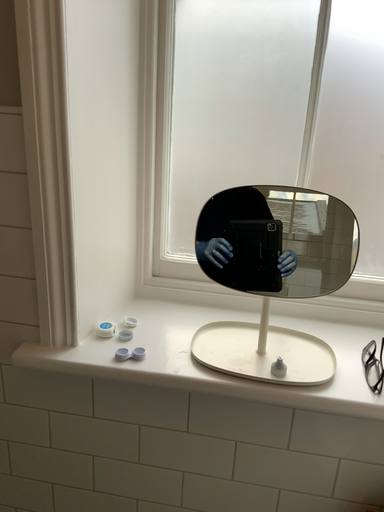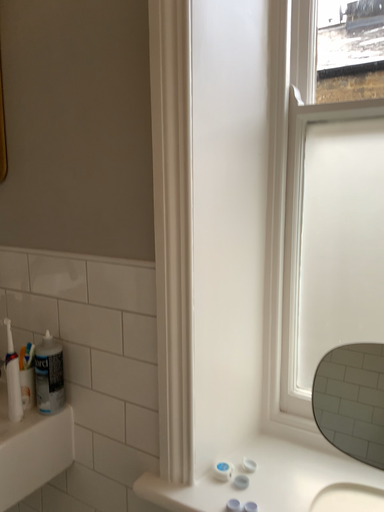
Question: Which way did the camera rotate in the video?

Choices:
 (A) rotated left
 (B) rotated right

Answer: (A)